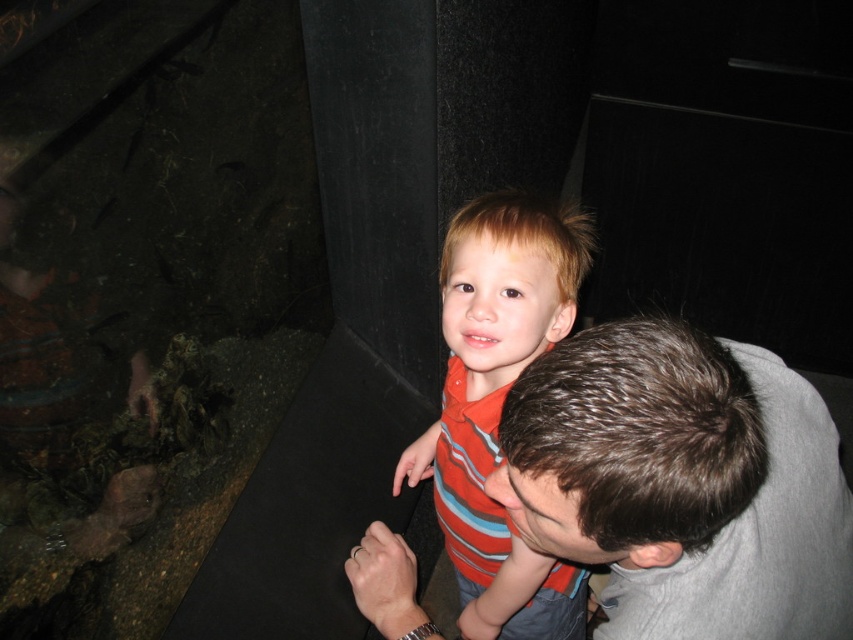
Looking at this image, which is more to the left, gray smooth shirt at upper right or striped cotton shirt at center?

From the viewer's perspective, striped cotton shirt at center appears more on the left side.

Between gray smooth shirt at upper right and striped cotton shirt at center, which one appears on the right side from the viewer's perspective?

gray smooth shirt at upper right

Between point (515, 516) and point (515, 248), which one is positioned in front?

Positioned in front is point (515, 516).

You are a GUI agent. You are given a task and a screenshot of the screen. Output one action in this format:
    pyautogui.click(x=<x>, y=<y>)
    Task: Click on the gray smooth shirt at upper right
    
    Given the screenshot: What is the action you would take?
    pyautogui.click(x=682, y=483)